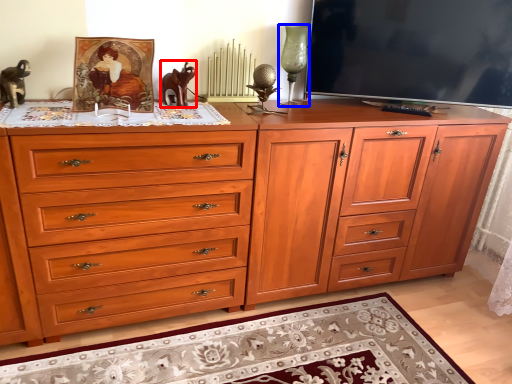
Question: Which object is closer to the camera taking this photo, animal (highlighted by a red box) or candle holder (highlighted by a blue box)?

Choices:
 (A) animal
 (B) candle holder

Answer: (A)